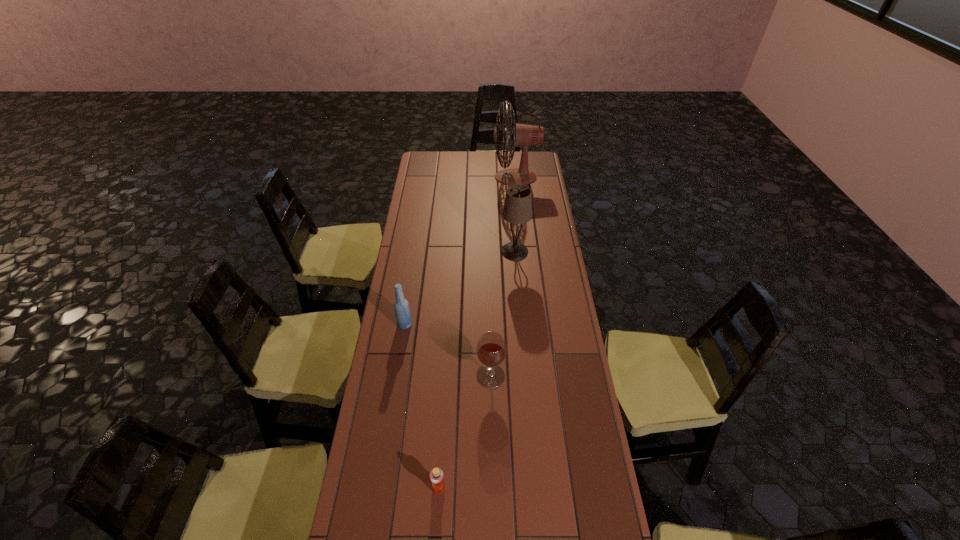
You are a GUI agent. You are given a task and a screenshot of the screen. Output one action in this format:
    pyautogui.click(x=<x>, y=<y>)
    Task: Click on the vacant area that lies between the tallest object and the shortest object
    The height and width of the screenshot is (540, 960).
    Given the screenshot: What is the action you would take?
    pyautogui.click(x=477, y=333)

Identify the location of vacant area that lies between the wineglass and the lampshade. The width and height of the screenshot is (960, 540). (503, 314).

What are the coordinates of `empty space that is in between the fourth nearest object and the bottle` in the screenshot? It's located at (460, 288).

You are a GUI agent. You are given a task and a screenshot of the screen. Output one action in this format:
    pyautogui.click(x=<x>, y=<y>)
    Task: Click on the vacant space that is in between the shortest object and the fan
    The width and height of the screenshot is (960, 540).
    Given the screenshot: What is the action you would take?
    pyautogui.click(x=477, y=333)

Locate an element on the screen. This screenshot has width=960, height=540. vacant region between the second object from left to right and the lampshade is located at coordinates (477, 370).

What are the coordinates of `object that is the third closest to the farthest object` in the screenshot? It's located at (491, 349).

Locate an element on the screen. object that stands as the fourth closest to the leftmost object is located at coordinates (521, 135).